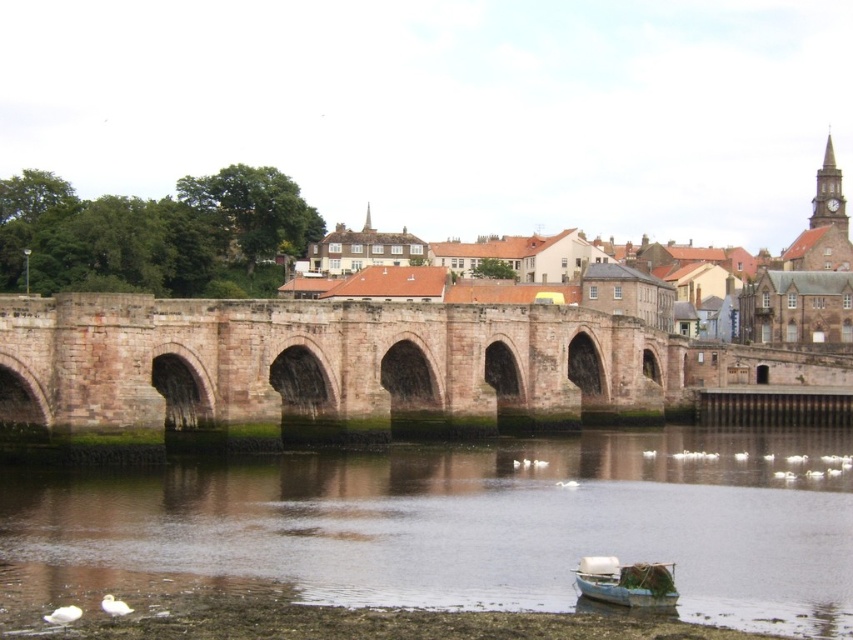
You are standing on the riverside and want to determine which of the two points, point (321, 348) or point (577, 282), is closer to you. Based on the scene, can you identify the closer point?

Point (321, 348) is closer to the viewer than point (577, 282).

You are an architect planning to build a small wooden dock for the boat at the shore. The dock must be placed between the brown stone river at lower center and the brown stone bridge at center. Which side of the dock should be closer to the river to ensure it can fit within the available space?

The brown stone river at lower center is thinner than the brown stone bridge at center, so the dock should be placed closer to the river to ensure it fits within the narrower space provided by the river.